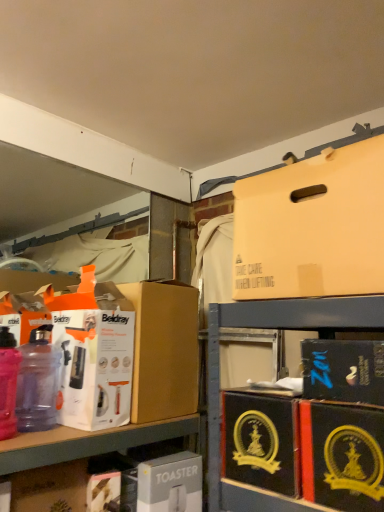
Measure the distance between point [356,421] and camera.

They are 28.11 inches apart.

Identify the location of black cardboard box at lower right, the second box ordered from the bottom. The width and height of the screenshot is (384, 512). (261, 440).

Describe the element at coordinates (170, 483) in the screenshot. This screenshot has width=384, height=512. I see `white cardboard toaster at lower center, which is counted as the first box, starting from the bottom` at that location.

What is the approximate width of matte black box at lower right, the 2th box positioned from the top?

The width of matte black box at lower right, the 2th box positioned from the top, is 7.15 inches.

This screenshot has width=384, height=512. Describe the element at coordinates (8, 383) in the screenshot. I see `translucent plastic bottle at left, acting as the 2th bottle starting from the right` at that location.

Measure the distance between transparent plastic bottle at left, which ranks as the 2th bottle in left-to-right order, and camera.

A distance of 1.08 meters exists between transparent plastic bottle at left, which ranks as the 2th bottle in left-to-right order, and camera.

I want to click on matte cardboard box at lower left, so click(50, 488).

The height and width of the screenshot is (512, 384). Describe the element at coordinates (50, 488) in the screenshot. I see `matte cardboard box at lower left` at that location.

Where is `black cardboard box at lower right, the 3th box when ordered from bottom to top`? The height and width of the screenshot is (512, 384). black cardboard box at lower right, the 3th box when ordered from bottom to top is located at coordinates (342, 456).

Which is in front, transparent plastic bottle at left, which ranks as the 2th bottle in left-to-right order, or black cardboard box at lower right, the 3th box when ordered from bottom to top?

black cardboard box at lower right, the 3th box when ordered from bottom to top, is in front.

How far apart are transparent plastic bottle at left, which ranks as the 2th bottle in left-to-right order, and black cardboard box at lower right, which is counted as the 4th box, starting from the top?

transparent plastic bottle at left, which ranks as the 2th bottle in left-to-right order, is 29.43 inches from black cardboard box at lower right, which is counted as the 4th box, starting from the top.

From a real-world perspective, is transparent plastic bottle at left, which ranks as the 2th bottle in left-to-right order, located beneath black cardboard box at lower right, which is counted as the 4th box, starting from the top?

No, from a real-world perspective, transparent plastic bottle at left, which ranks as the 2th bottle in left-to-right order, is not beneath black cardboard box at lower right, which is counted as the 4th box, starting from the top.

Who is bigger, transparent plastic bottle at left, the first bottle when ordered from right to left, or black cardboard box at lower right, the 3th box when ordered from bottom to top?

With larger size is black cardboard box at lower right, the 3th box when ordered from bottom to top.

Locate an element on the screen. bottle that is the 2nd object located above the black cardboard box at lower right, the 3th box when ordered from bottom to top (from the image's perspective) is located at coordinates (8, 383).

How far apart are translucent plastic bottle at left, the 1th bottle from the left, and black cardboard box at lower right, the 3th box when ordered from bottom to top?

translucent plastic bottle at left, the 1th bottle from the left, and black cardboard box at lower right, the 3th box when ordered from bottom to top, are 29.99 inches apart from each other.

Would you say translucent plastic bottle at left, the 1th bottle from the left, is to the left or to the right of black cardboard box at lower right, which is counted as the 4th box, starting from the top, in the picture?

From the image, it's evident that translucent plastic bottle at left, the 1th bottle from the left, is to the left of black cardboard box at lower right, which is counted as the 4th box, starting from the top.

Measure the distance from black cardboard box at lower right, the 3th box when ordered from bottom to top, to translucent plastic bottle at left, acting as the 2th bottle starting from the right.

black cardboard box at lower right, the 3th box when ordered from bottom to top, is 29.99 inches from translucent plastic bottle at left, acting as the 2th bottle starting from the right.

Between black cardboard box at lower right, the 3th box when ordered from bottom to top, and translucent plastic bottle at left, acting as the 2th bottle starting from the right, which one has larger size?

With larger size is black cardboard box at lower right, the 3th box when ordered from bottom to top.

From the picture: From the image's perspective, is black cardboard box at lower right, which is counted as the 4th box, starting from the top, positioned above or below translucent plastic bottle at left, the 1th bottle from the left?

Clearly, from the image's perspective, black cardboard box at lower right, which is counted as the 4th box, starting from the top, is below translucent plastic bottle at left, the 1th bottle from the left.

At what (x,y) coordinates should I click in order to perform the action: click on the 2nd box located beneath the translucent plastic bottle at left, the 1th bottle from the left (from a real-world perspective). Please return your answer as a coordinate pair (x, y). Looking at the image, I should click on (342, 456).

Do you think matte black box at lower right, acting as the fifth box starting from the bottom, is within matte cardboard box at upper right, which is the 6th box from bottom to top, or outside of it?

The correct answer is: outside.

From a real-world perspective, which object rests below the other?

matte black box at lower right, acting as the fifth box starting from the bottom, is physically lower.

Does point (375, 387) come closer to viewer compared to point (286, 247)?

Yes, it is.

Who is bigger, black cardboard box at lower right, which is counted as the 4th box, starting from the top, or matte black box at lower right, acting as the fifth box starting from the bottom?

Bigger between the two is black cardboard box at lower right, which is counted as the 4th box, starting from the top.

Would you say matte black box at lower right, the 2th box positioned from the top, is part of black cardboard box at lower right, which is counted as the 4th box, starting from the top,'s contents?

No, matte black box at lower right, the 2th box positioned from the top, is not inside black cardboard box at lower right, which is counted as the 4th box, starting from the top.

From a real-world perspective, is black cardboard box at lower right, the 3th box when ordered from bottom to top, below matte black box at lower right, the 2th box positioned from the top?

Correct, in the physical world, black cardboard box at lower right, the 3th box when ordered from bottom to top, is lower than matte black box at lower right, the 2th box positioned from the top.

Is translucent plastic bottle at left, the 1th bottle from the left, facing towards white cardboard toaster at lower center, which ranks as the 6th box in top-to-bottom order?

No, translucent plastic bottle at left, the 1th bottle from the left, does not turn towards white cardboard toaster at lower center, which ranks as the 6th box in top-to-bottom order.

Is translucent plastic bottle at left, acting as the 2th bottle starting from the right, bigger or smaller than white cardboard toaster at lower center, which is counted as the first box, starting from the bottom?

Considering their sizes, translucent plastic bottle at left, acting as the 2th bottle starting from the right, takes up less space than white cardboard toaster at lower center, which is counted as the first box, starting from the bottom.

From a real-world perspective, is translucent plastic bottle at left, the 1th bottle from the left, positioned over white cardboard toaster at lower center, which is counted as the first box, starting from the bottom, based on gravity?

Indeed, from a real-world perspective, translucent plastic bottle at left, the 1th bottle from the left, stands above white cardboard toaster at lower center, which is counted as the first box, starting from the bottom.

Can you confirm if matte cardboard box at lower left is positioned to the left of matte black box at lower right, the 2th box positioned from the top?

Yes.

Does matte cardboard box at lower left contain matte black box at lower right, acting as the fifth box starting from the bottom?

No, matte cardboard box at lower left does not contain matte black box at lower right, acting as the fifth box starting from the bottom.

Does matte cardboard box at lower left have a smaller size compared to matte black box at lower right, acting as the fifth box starting from the bottom?

No.

Locate an element on the screen. the 2nd bottle behind the black cardboard box at lower right, the 3th box when ordered from bottom to top is located at coordinates [x=38, y=382].

What are the coordinates of `the 2nd bottle counting from the left of the black cardboard box at lower right, which is counted as the 4th box, starting from the top` in the screenshot? It's located at (8, 383).

Looking at the image, which one is located closer to black cardboard box at lower right, the second box ordered from the bottom, matte cardboard box at upper right, which is counted as the first box, starting from the top, or brown cardboard box at center, which ranks as the fourth box in bottom-to-top order?

Among the two, matte cardboard box at upper right, which is counted as the first box, starting from the top, is located nearer to black cardboard box at lower right, the second box ordered from the bottom.

Which object lies further to the anchor point matte cardboard box at upper right, which is counted as the first box, starting from the top, white cardboard toaster at lower center, which is counted as the first box, starting from the bottom, or translucent plastic bottle at left, the 1th bottle from the left?

The object further to matte cardboard box at upper right, which is counted as the first box, starting from the top, is white cardboard toaster at lower center, which is counted as the first box, starting from the bottom.

When comparing their distances from black cardboard box at lower right, the fifth box in the top-to-bottom sequence, does transparent plastic bottle at left, the first bottle when ordered from right to left, or brown cardboard box at center, which is counted as the third box, starting from the top, seem closer?

The object closer to black cardboard box at lower right, the fifth box in the top-to-bottom sequence, is brown cardboard box at center, which is counted as the third box, starting from the top.

From the image, which object appears to be nearer to black cardboard box at lower right, the 3th box when ordered from bottom to top, black cardboard box at lower right, the second box ordered from the bottom, or matte cardboard box at lower left?

black cardboard box at lower right, the second box ordered from the bottom, is closer to black cardboard box at lower right, the 3th box when ordered from bottom to top.

Based on the photo, looking at the image, which one is located further to black cardboard box at lower right, the 3th box when ordered from bottom to top, black cardboard box at lower right, the fifth box in the top-to-bottom sequence, or white cardboard toaster at lower center, which ranks as the 6th box in top-to-bottom order?

The object further to black cardboard box at lower right, the 3th box when ordered from bottom to top, is white cardboard toaster at lower center, which ranks as the 6th box in top-to-bottom order.

Based on their spatial positions, is white cardboard toaster at lower center, which ranks as the 6th box in top-to-bottom order, or transparent plastic bottle at left, which ranks as the 2th bottle in left-to-right order, further from matte cardboard box at lower left?

white cardboard toaster at lower center, which ranks as the 6th box in top-to-bottom order, is positioned further to the anchor matte cardboard box at lower left.

Which object lies further to the anchor point white cardboard toaster at lower center, which ranks as the 6th box in top-to-bottom order, matte cardboard box at upper right, which is the 6th box from bottom to top, or matte cardboard box at lower left?

matte cardboard box at upper right, which is the 6th box from bottom to top, is further to white cardboard toaster at lower center, which ranks as the 6th box in top-to-bottom order.

Consider the image. Looking at the image, which one is located further to white cardboard toaster at lower center, which ranks as the 6th box in top-to-bottom order, translucent plastic bottle at left, acting as the 2th bottle starting from the right, or black cardboard box at lower right, the 3th box when ordered from bottom to top?

black cardboard box at lower right, the 3th box when ordered from bottom to top, lies further to white cardboard toaster at lower center, which ranks as the 6th box in top-to-bottom order, than the other object.

Where is `storage box between brown cardboard box at center, which ranks as the fourth box in bottom-to-top order, and white cardboard toaster at lower center, which is counted as the first box, starting from the bottom, from top to bottom`? The image size is (384, 512). storage box between brown cardboard box at center, which ranks as the fourth box in bottom-to-top order, and white cardboard toaster at lower center, which is counted as the first box, starting from the bottom, from top to bottom is located at coordinates (x=50, y=488).

What are the coordinates of `storage box that lies between transparent plastic bottle at left, which ranks as the 2th bottle in left-to-right order, and white cardboard toaster at lower center, which ranks as the 6th box in top-to-bottom order, from top to bottom` in the screenshot? It's located at (50, 488).

Find the location of `bottle between matte cardboard box at lower left and matte black box at lower right, acting as the fifth box starting from the bottom, in the horizontal direction`. bottle between matte cardboard box at lower left and matte black box at lower right, acting as the fifth box starting from the bottom, in the horizontal direction is located at coordinates (38, 382).

Identify the location of bottle between translucent plastic bottle at left, the 1th bottle from the left, and matte cardboard box at lower left from top to bottom. The height and width of the screenshot is (512, 384). (38, 382).